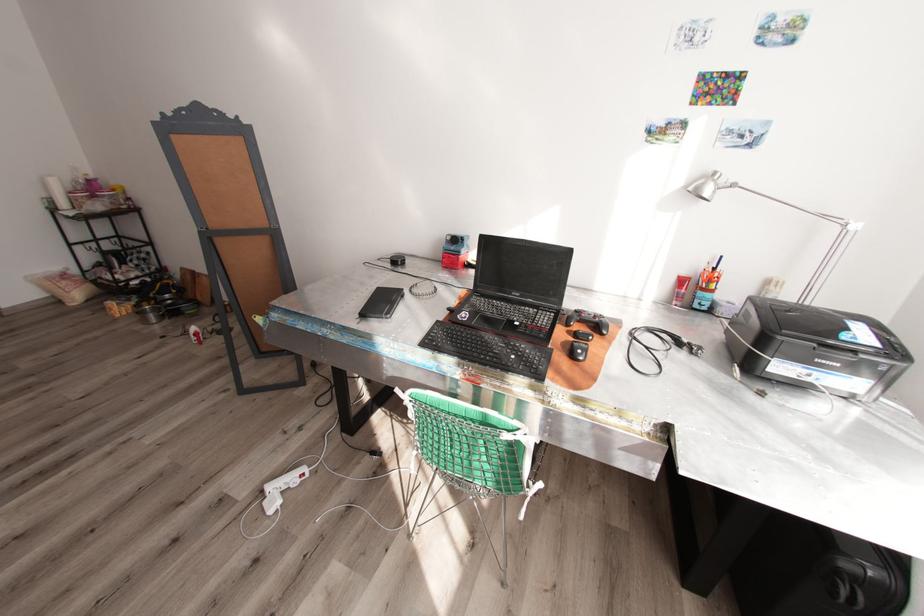
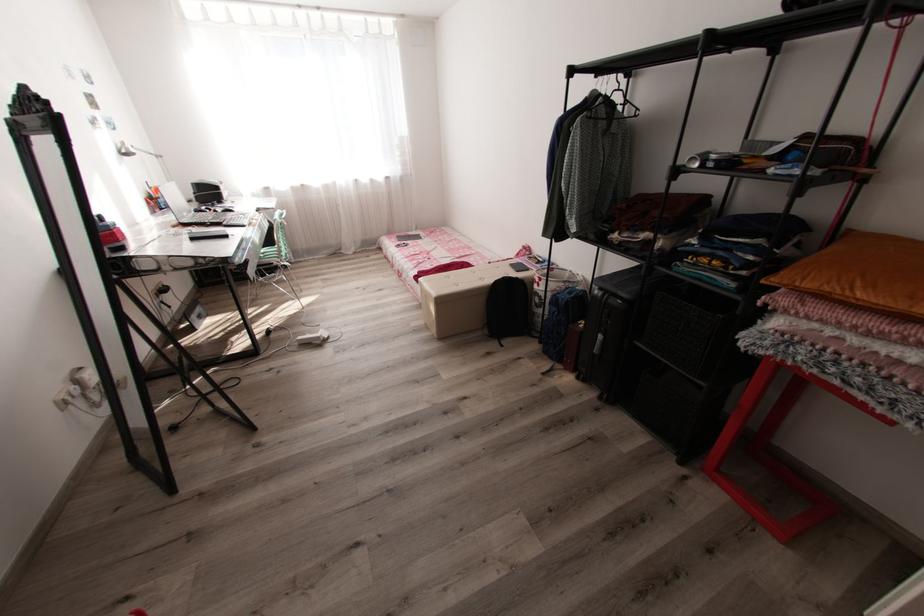
Find the pixel in the second image that matches point (695, 188) in the first image.

(129, 151)